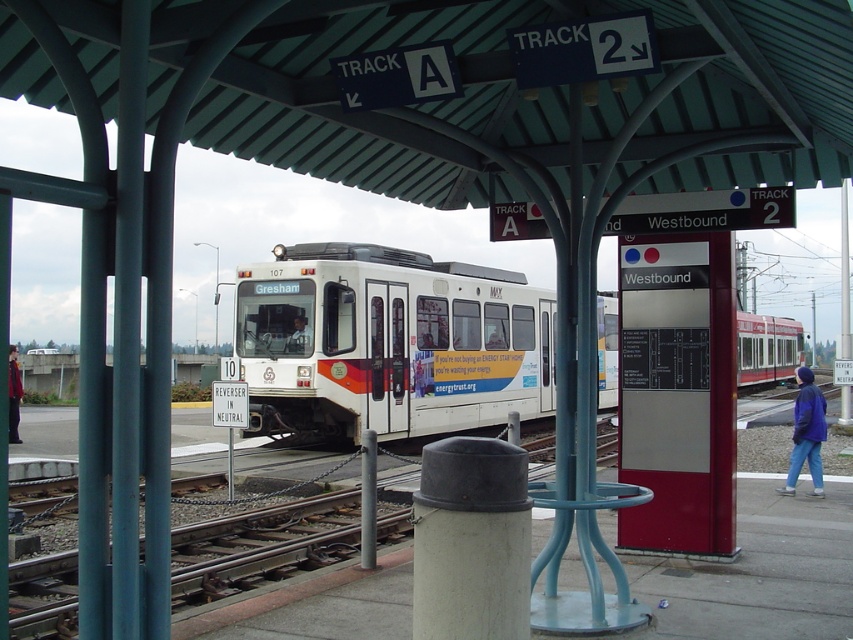
Which is more to the left, red jacket at lower left or matte black train at center?

From the viewer's perspective, red jacket at lower left appears more on the left side.

Which of these two, red jacket at lower left or matte black train at center, stands taller?

With more height is red jacket at lower left.

Is point (10, 390) in front of point (294, 336)?

No, it is behind (294, 336).

The image size is (853, 640). What are the coordinates of `red jacket at lower left` in the screenshot? It's located at (13, 396).

Which is more to the right, white glossy train at center or white matte trash can at center?

white glossy train at center

Between white glossy train at center and white matte trash can at center, which one has more height?

white glossy train at center is taller.

Is point (299, 253) farther from camera compared to point (498, 486)?

Yes.

Locate an element on the screen. This screenshot has width=853, height=640. white glossy train at center is located at coordinates (390, 342).

Is point (801, 394) less distant than point (21, 387)?

That is True.

Identify the location of blue denim jacket at lower right. This screenshot has height=640, width=853. (805, 433).